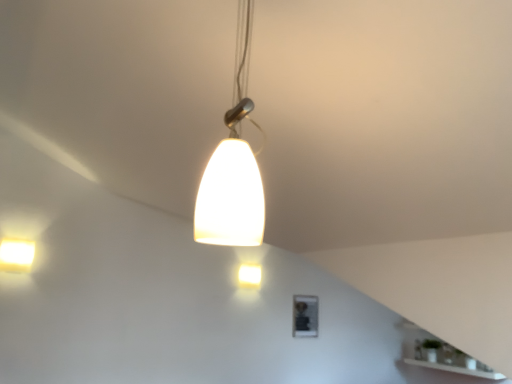
Question: Considering their positions, is matte white pendant light at center, which is the 3th lamp from back to front, located in front of or behind matte white light fixture at upper left, acting as the second lamp starting from the front?

Choices:
 (A) front
 (B) behind

Answer: (A)

Question: From a real-world perspective, is matte white pendant light at center, the third lamp in the bottom-to-top sequence, positioned above or below matte white light fixture at upper left, the 2th lamp in the bottom-to-top sequence?

Choices:
 (A) below
 (B) above

Answer: (B)

Question: Which object is the closest to the matte white light fixture at upper left, the 2th lamp in the bottom-to-top sequence?

Choices:
 (A) matte white pendant light at center, arranged as the first lamp when viewed from the top
 (B) matte white light fixture at center, placed as the first lamp when sorted from back to front

Answer: (B)

Question: Estimate the real-world distances between objects in this image. Which object is farther from the matte white pendant light at center, positioned as the 3th lamp in left-to-right order?

Choices:
 (A) matte white light fixture at upper left, acting as the second lamp starting from the front
 (B) matte white light fixture at center, which is counted as the 1th lamp, starting from the bottom

Answer: (B)